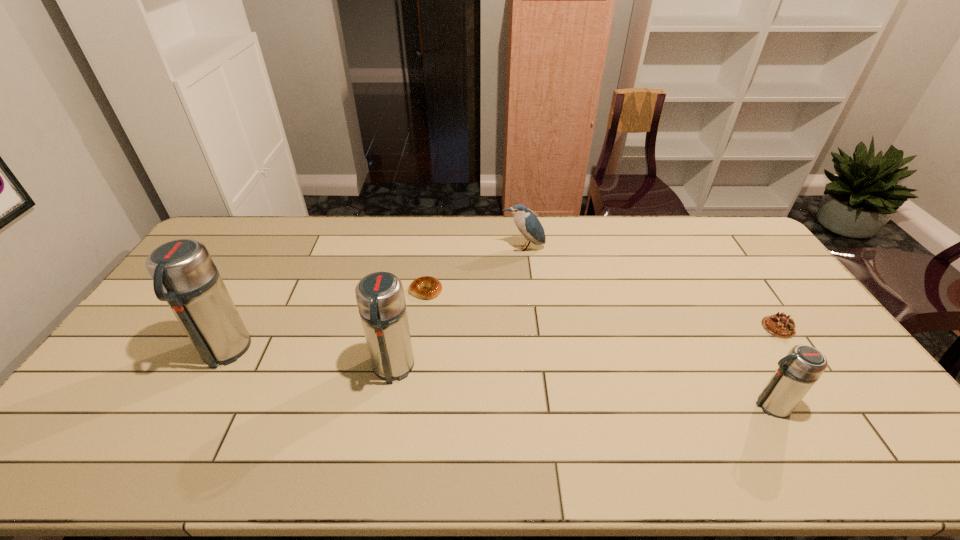
Locate an element on the screen. This screenshot has height=540, width=960. object situated at the right edge is located at coordinates [779, 325].

The height and width of the screenshot is (540, 960). In the image, there is a desktop. What are the coordinates of `blank space at the far edge` in the screenshot? It's located at (494, 241).

In the image, there is a desktop. Identify the location of vacant space at the near edge. (365, 399).

The width and height of the screenshot is (960, 540). What are the coordinates of `free space at the left edge of the desktop` in the screenshot? It's located at (216, 260).

This screenshot has width=960, height=540. What are the coordinates of `vacant space at the far left corner of the desktop` in the screenshot? It's located at (239, 237).

Identify the location of free space at the far right corner of the desktop. (726, 217).

The width and height of the screenshot is (960, 540). What are the coordinates of `vacant region at the near right corner of the desktop` in the screenshot? It's located at (828, 410).

Identify the location of vacant region between the leftmost object and the nearest object. The image size is (960, 540). (497, 379).

Where is `free space between the rightmost object and the shortest object`? free space between the rightmost object and the shortest object is located at coordinates (602, 309).

Locate an element on the screen. Image resolution: width=960 pixels, height=540 pixels. free spot between the leftmost object and the nearest thermos bottle is located at coordinates (497, 379).